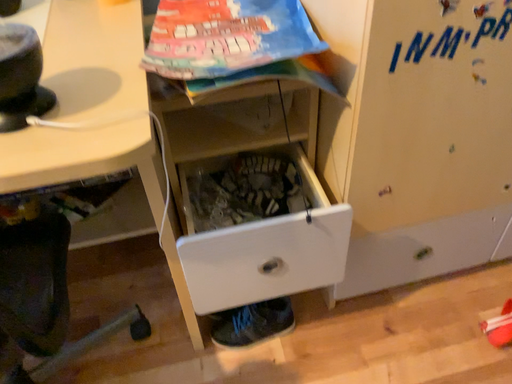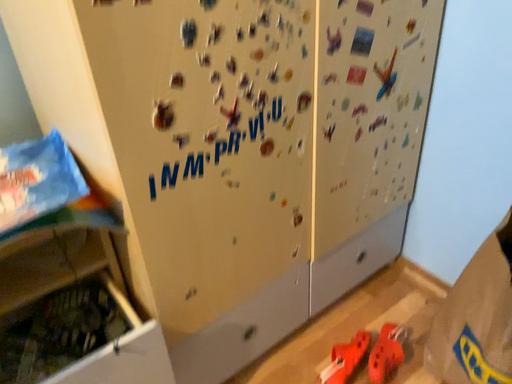
Question: How did the camera likely rotate when shooting the video?

Choices:
 (A) rotated downward
 (B) rotated upward

Answer: (B)